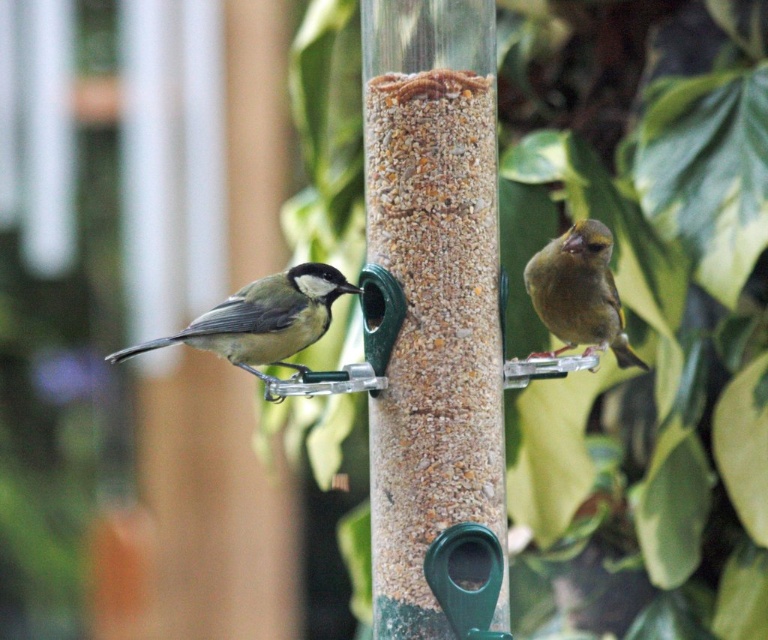
In the scene shown: Does matte gray bird at left lie in front of green matte bird at right?

Yes, it is in front of green matte bird at right.

Between point (194, 324) and point (606, 296), which one is positioned behind?

Positioned behind is point (606, 296).

Locate an element on the screen. matte gray bird at left is located at coordinates (262, 321).